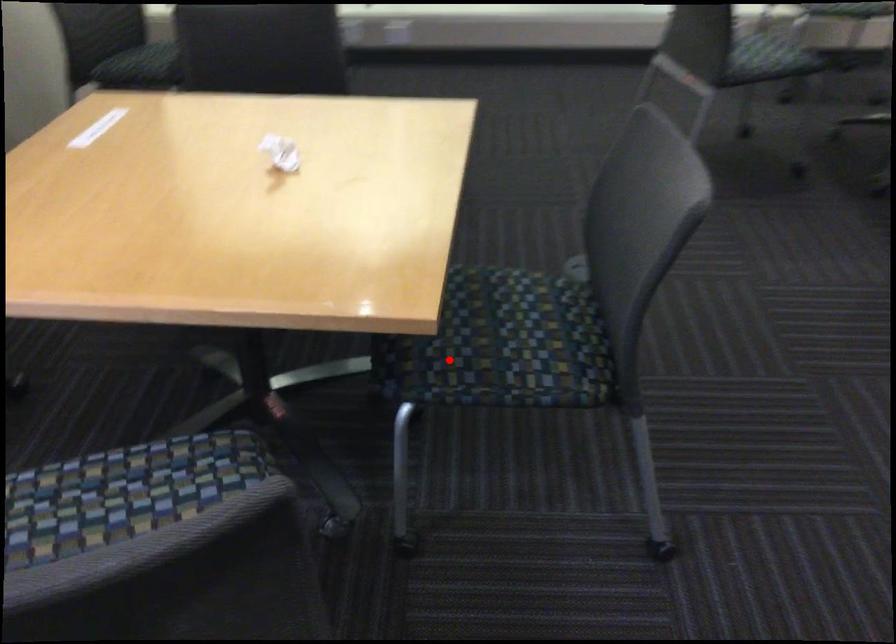
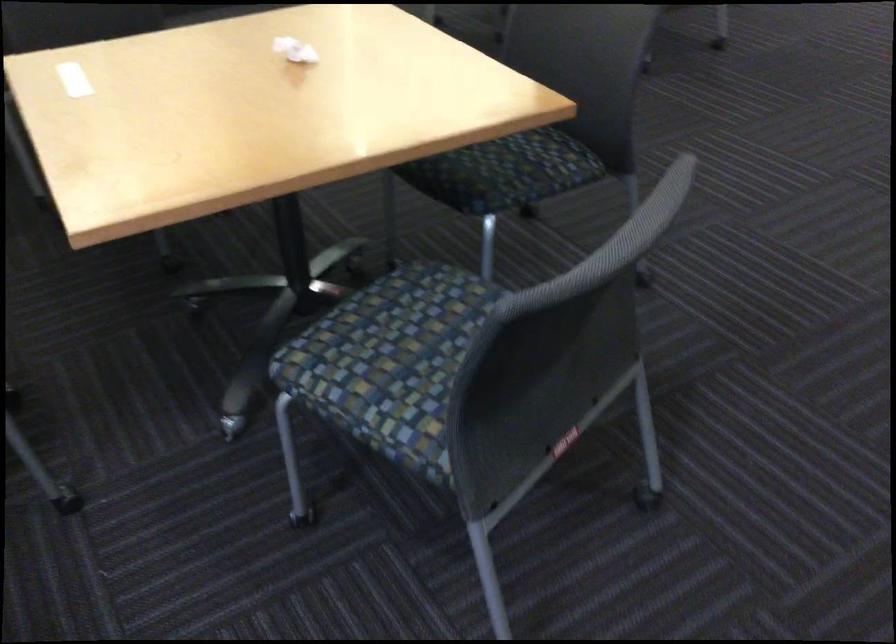
The point at the highlighted location is marked in the first image. Where is the corresponding point in the second image?

(504, 172)